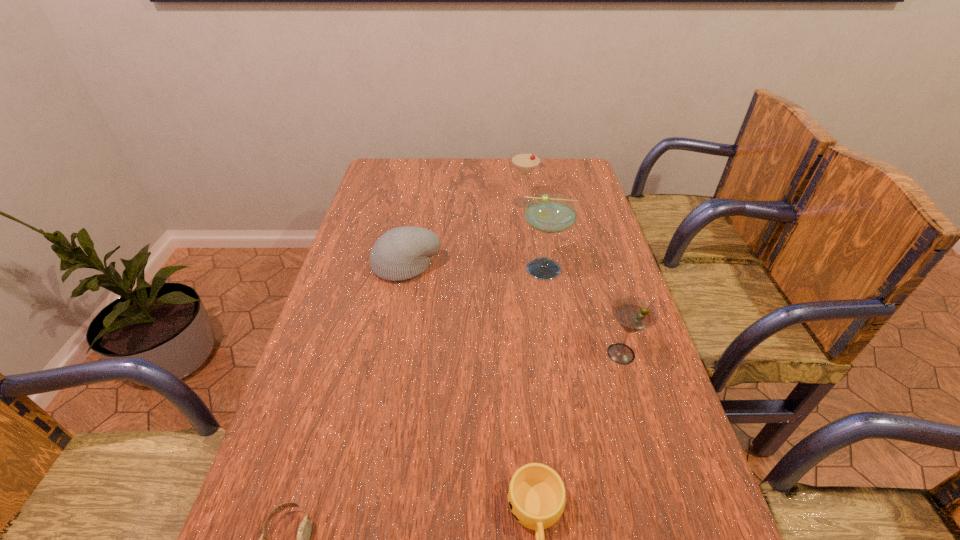
Identify the location of object located in the left edge section of the desktop. This screenshot has height=540, width=960. (401, 253).

The width and height of the screenshot is (960, 540). I want to click on vacant region at the far edge of the desktop, so click(x=443, y=160).

Identify the location of vacant region at the left edge of the desktop. This screenshot has width=960, height=540. (348, 303).

At what (x,y) coordinates should I click in order to perform the action: click on vacant region at the right edge of the desktop. Please return your answer as a coordinate pair (x, y). Image resolution: width=960 pixels, height=540 pixels. Looking at the image, I should click on (588, 259).

I want to click on free spot between the nearest martini and the tallest object, so click(x=584, y=311).

The image size is (960, 540). Identify the location of free space that is in between the fourth tallest object and the tallest martini. 476,267.

The image size is (960, 540). Find the location of `blank region between the second farthest martini and the third nearest object`. blank region between the second farthest martini and the third nearest object is located at coordinates (584, 311).

In order to click on unoccupied position between the third shortest object and the rightmost object in this screenshot , I will do `click(514, 309)`.

At what (x,y) coordinates should I click in order to perform the action: click on the closest object relative to the second shortest object. Please return your answer as a coordinate pair (x, y). Looking at the image, I should click on (634, 314).

Locate an element on the screen. The image size is (960, 540). the fifth closest object to the tallest object is located at coordinates click(x=304, y=530).